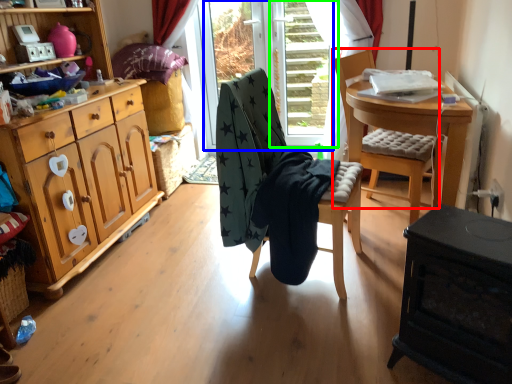
Question: Based on their relative distances, which object is farther from chair (highlighted by a red box)? Choose from glass door (highlighted by a blue box) and screen door (highlighted by a green box).

Choices:
 (A) glass door
 (B) screen door

Answer: (A)